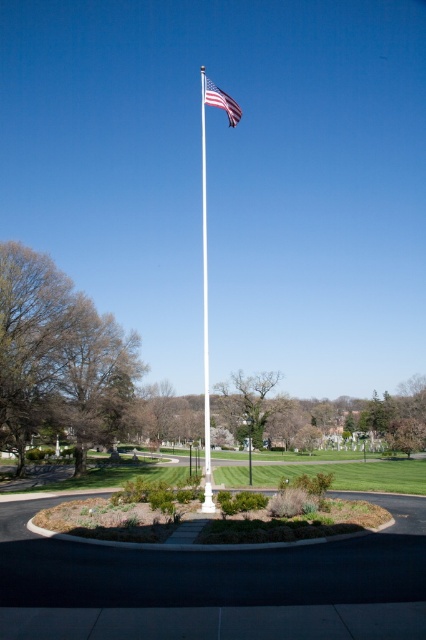
Who is more forward, [417,458] or [209,97]?

Point [209,97]

Can you confirm if green grass at center is thinner than american flag at center?

No.

Who is more distant from viewer, (186, 458) or (229, 115)?

The point (186, 458) is more distant.

Find the location of a particular element. green grass at center is located at coordinates (353, 474).

Can you confirm if green grass at center is positioned above white glossy flagpole at center?

Actually, green grass at center is below white glossy flagpole at center.

Is green grass at center wider than white glossy flagpole at center?

Yes.

Locate an element on the screen. The height and width of the screenshot is (640, 426). green grass at center is located at coordinates (353, 474).

Does white glossy flagpole at center have a smaller size compared to american flag at center?

Actually, white glossy flagpole at center might be larger than american flag at center.

Who is positioned more to the left, white glossy flagpole at center or american flag at center?

Positioned to the left is white glossy flagpole at center.

Which is behind, point (204, 326) or point (218, 104)?

Point (204, 326)

I want to click on white glossy flagpole at center, so click(x=204, y=310).